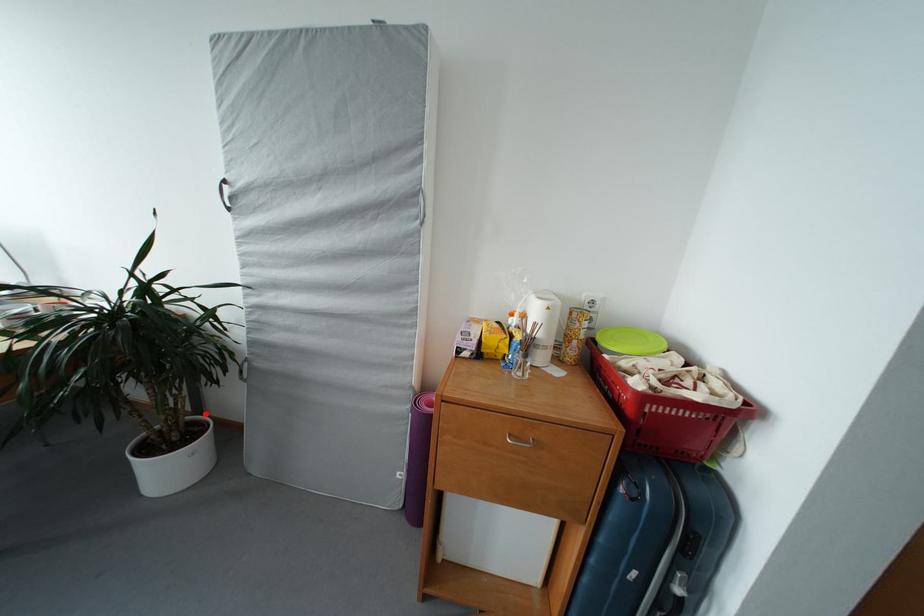
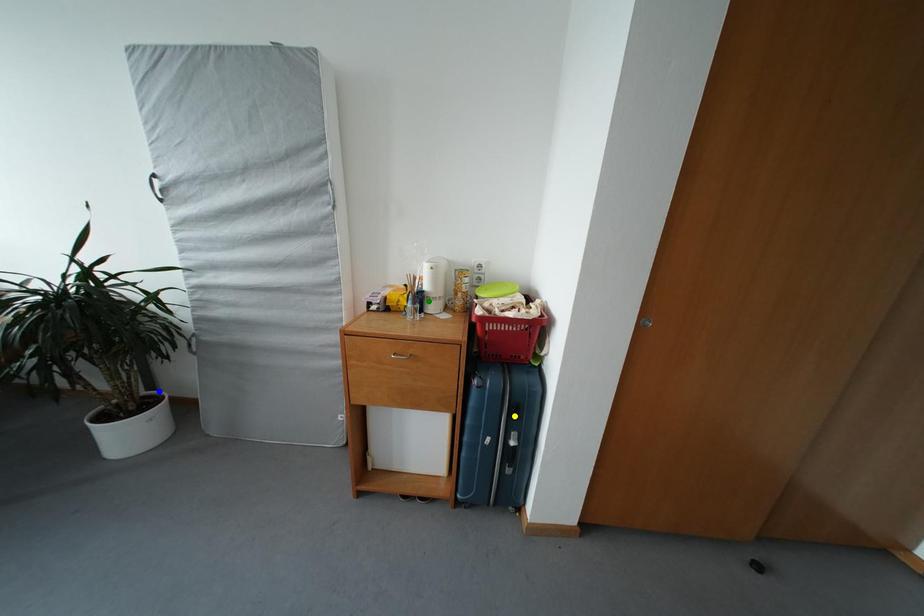
Question: I am providing you with two images of the same scene from different viewpoints. A red point is marked on the first image. You are given multiple points on the second image. Which point in image 2 represents the same 3d spot as the red point in image 1?

Choices:
 (A) blue point
 (B) green point
 (C) yellow point

Answer: (A)